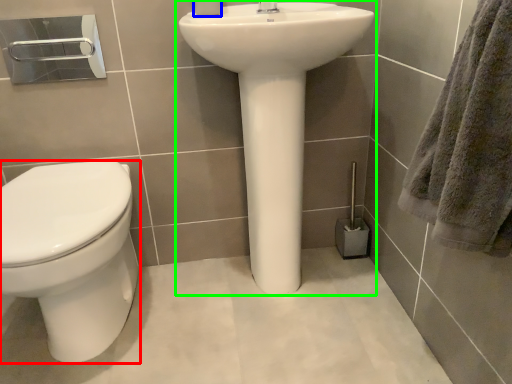
Question: Which object is the closest to the bidet (highlighted by a red box)? Choose among these: toilet paper (highlighted by a blue box) or sink (highlighted by a green box).

Choices:
 (A) toilet paper
 (B) sink

Answer: (B)